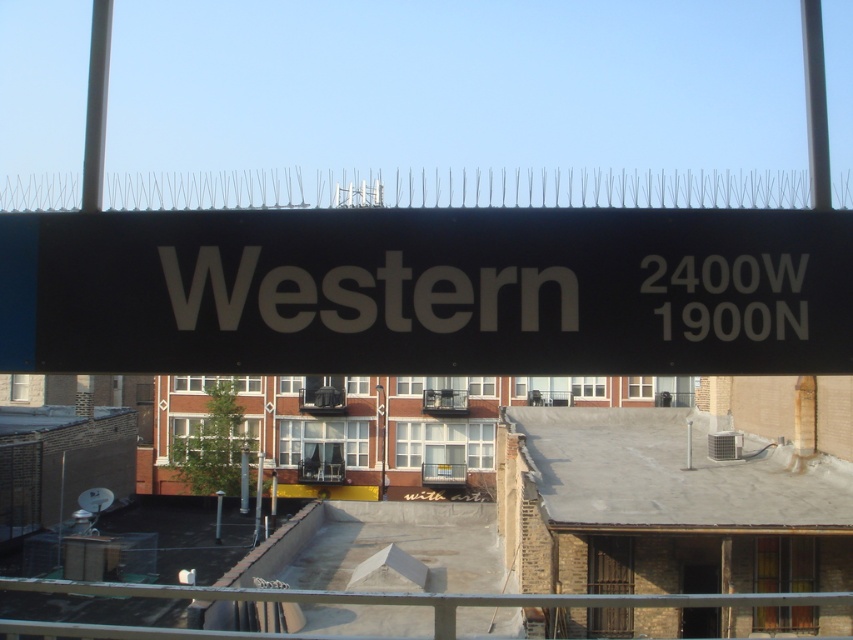
You are standing on the rooftop and looking around. You see the black matte sign at upper center and the metallic pole at upper left. Which object is positioned higher up from the ground?

The metallic pole at upper left is positioned higher up from the ground than the black matte sign at upper center because the black matte sign at upper center is located below it.